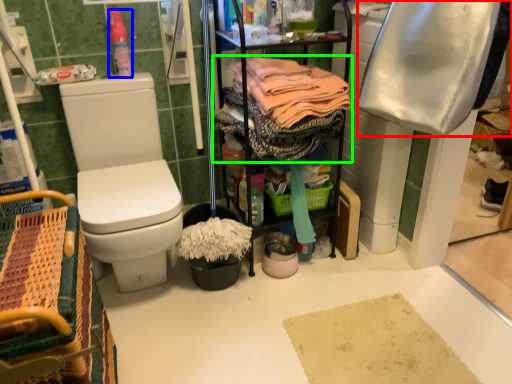
Question: Based on their relative distances, which object is nearer to clothing (highlighted by a red box)? Choose from cleaning products (highlighted by a blue box) and clothing (highlighted by a green box).

Choices:
 (A) cleaning products
 (B) clothing

Answer: (B)